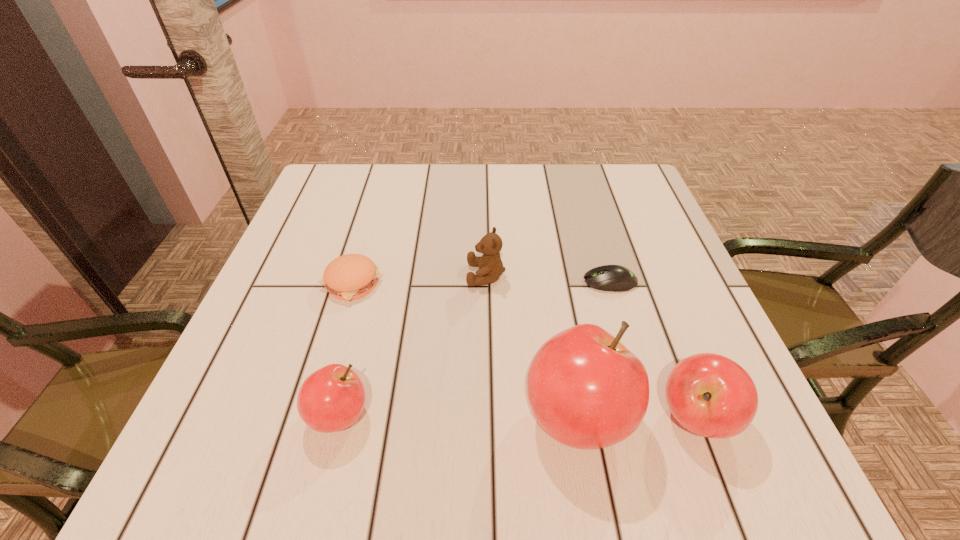
The height and width of the screenshot is (540, 960). What are the coordinates of `object at the near right corner` in the screenshot? It's located at (710, 395).

At what (x,y) coordinates should I click in order to perform the action: click on vacant area at the far edge of the desktop. Please return your answer as a coordinate pair (x, y). Looking at the image, I should click on coord(465,181).

Image resolution: width=960 pixels, height=540 pixels. I want to click on free space at the near edge of the desktop, so [x=382, y=384].

The image size is (960, 540). Identify the location of vacant area at the left edge of the desktop. click(306, 269).

In order to click on free space at the right edge in this screenshot , I will do `click(668, 248)`.

Where is `vacant space at the far left corner of the desktop`? The height and width of the screenshot is (540, 960). vacant space at the far left corner of the desktop is located at coordinates (308, 201).

The width and height of the screenshot is (960, 540). In the image, there is a desktop. In order to click on free space at the far right corner in this screenshot , I will do `click(622, 184)`.

You are a GUI agent. You are given a task and a screenshot of the screen. Output one action in this format:
    pyautogui.click(x=<x>, y=<y>)
    Task: Click on the vacant space that is in between the tallest apple and the third object from left to right
    This screenshot has width=960, height=540.
    Given the screenshot: What is the action you would take?
    pyautogui.click(x=532, y=346)

Image resolution: width=960 pixels, height=540 pixels. In order to click on unoccupied position between the patty and the shortest apple in this screenshot , I will do `click(346, 349)`.

You are a GUI agent. You are given a task and a screenshot of the screen. Output one action in this format:
    pyautogui.click(x=<x>, y=<y>)
    Task: Click on the free space between the tallest object and the fifth tallest object
    Image resolution: width=960 pixels, height=540 pixels.
    Given the screenshot: What is the action you would take?
    pyautogui.click(x=465, y=350)